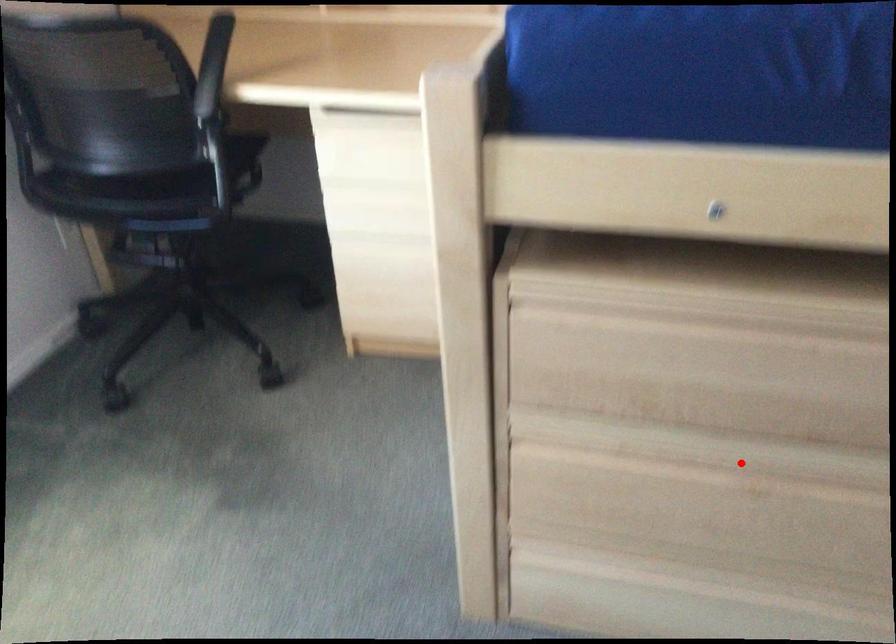
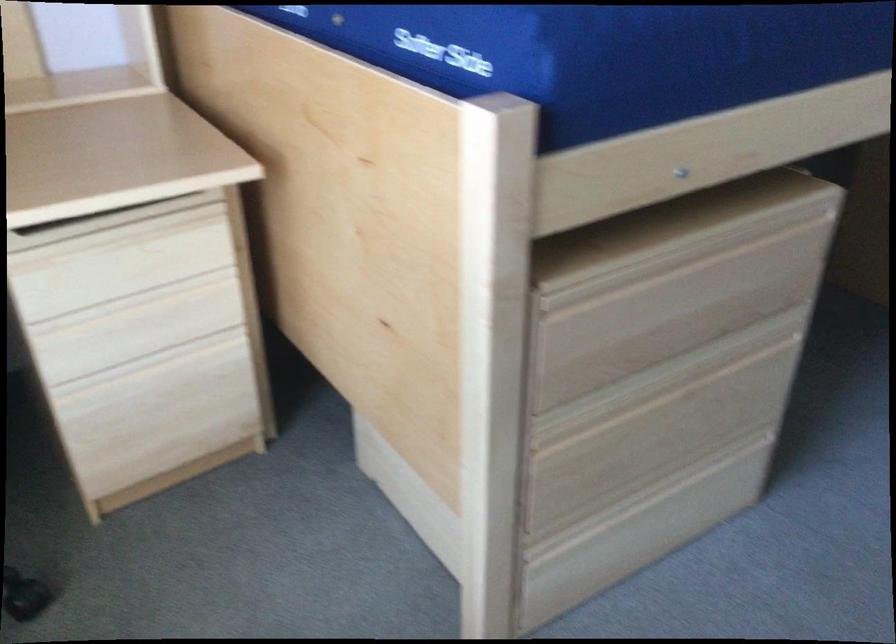
Where in the second image is the point corresponding to the highlighted location from the first image?

(673, 377)